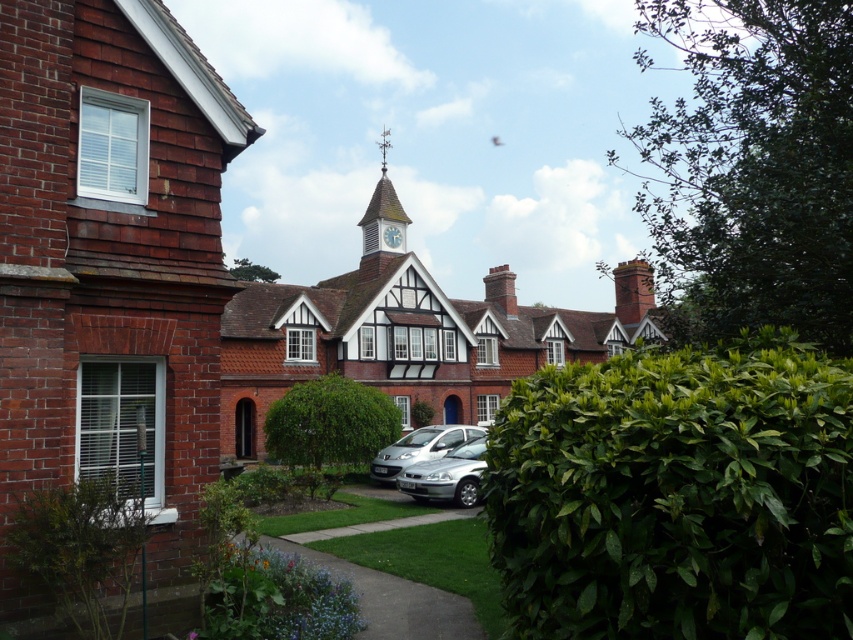
You are a visitor approaching the brick house at left and wooden spire at center. Which structure would appear taller to you as you walk towards them?

The wooden spire at center appears taller than the brick house at left because the brick house at left is not as tall as the wooden spire at center.

You are standing at the center of the image. There is a point marked at coordinate (109, 268). What is located at that point?

The point at coordinate (109, 268) is occupied by the brick house at left.

You are a gardener tasked with trimming the green leafy hedge at lower right and the wooden spire at center. Which of these two objects requires more effort to maintain due to its size?

The wooden spire at center requires more effort to maintain because it is thicker than the green leafy hedge at lower right.